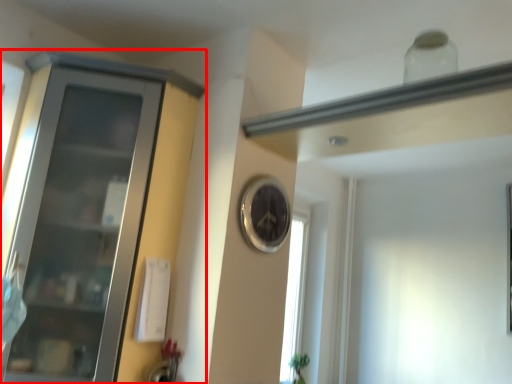
Question: From the image's perspective, where is cupboard (annotated by the red box) located in relation to clock in the image?

Choices:
 (A) above
 (B) below

Answer: (B)